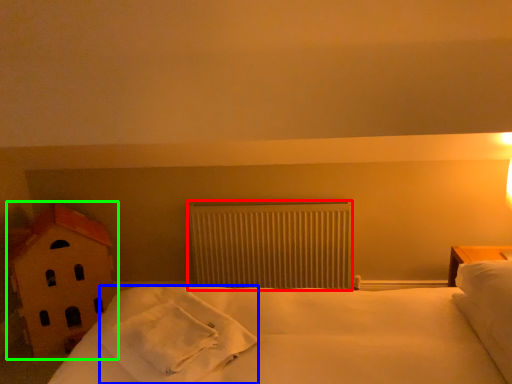
Question: Which object is positioned farthest from radiator (highlighted by a red box)? Select from material (highlighted by a blue box) and toy (highlighted by a green box).

Choices:
 (A) material
 (B) toy

Answer: (A)